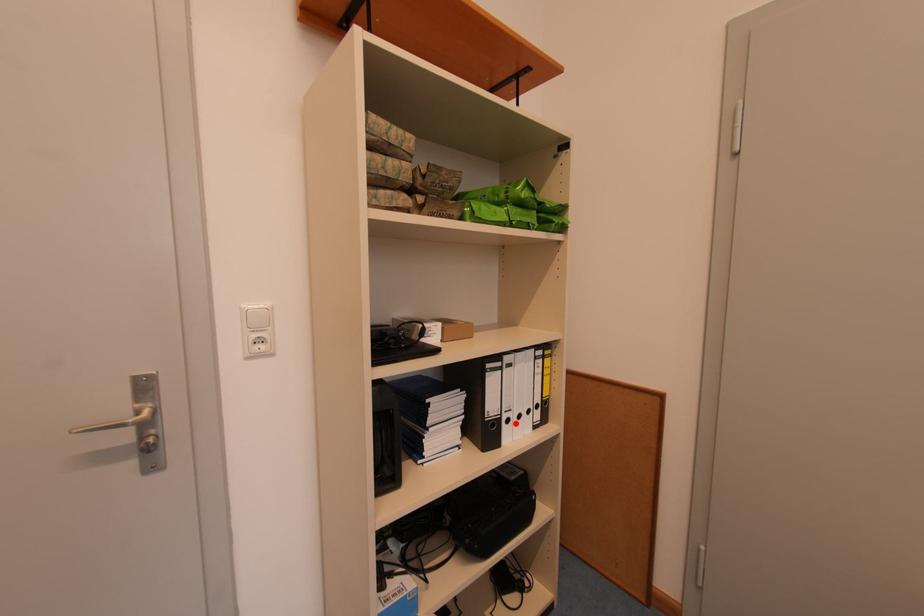
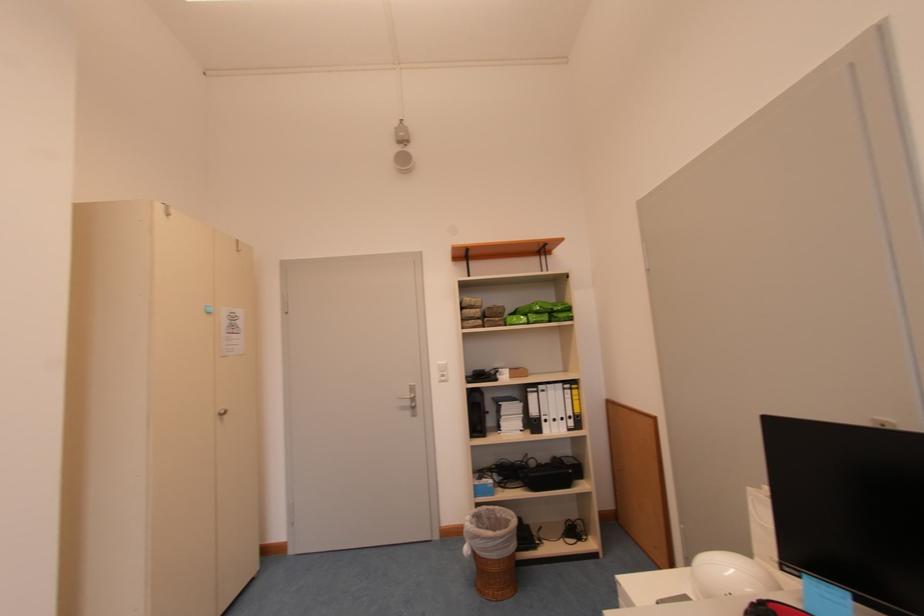
Question: I am providing you with two images of the same scene from different viewpoints. A red point is shown in image1. For the corresponding object point in image2, is it positioned nearer or farther from the camera?

Choices:
 (A) Nearer
 (B) Farther

Answer: (B)